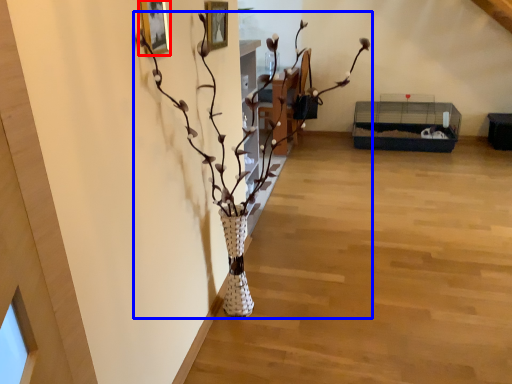
Question: Which object is further to the camera taking this photo, picture frame (highlighted by a red box) or houseplant (highlighted by a blue box)?

Choices:
 (A) picture frame
 (B) houseplant

Answer: (A)